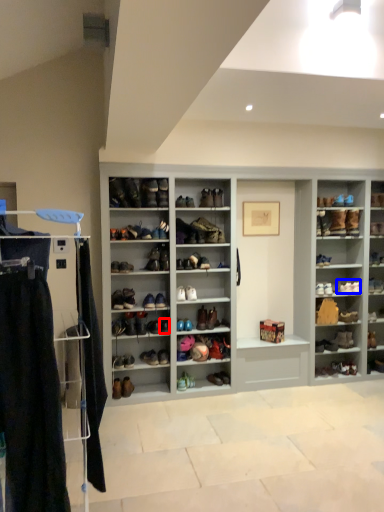
Question: Among these objects, which one is farthest to the camera, shoe (highlighted by a red box) or shoe (highlighted by a blue box)?

Choices:
 (A) shoe
 (B) shoe

Answer: (B)